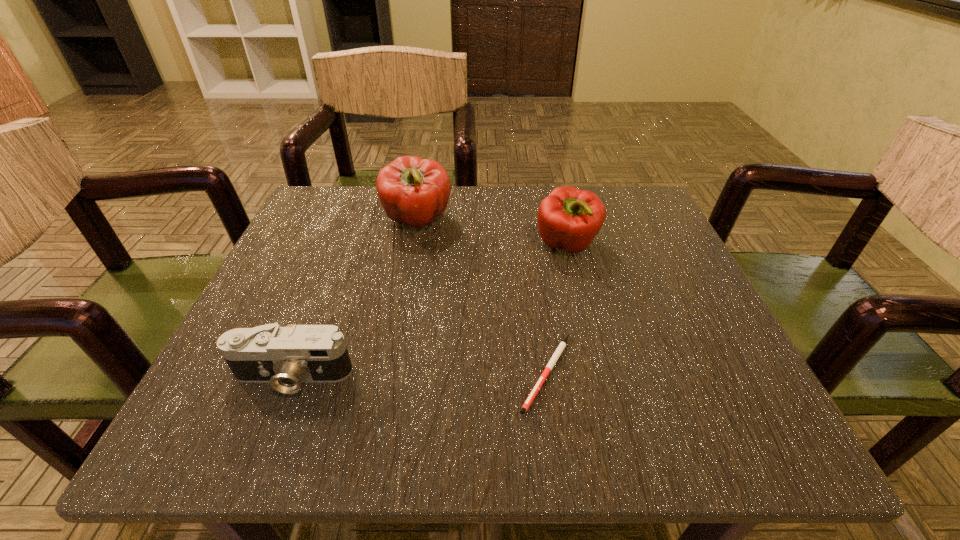
Image resolution: width=960 pixels, height=540 pixels. What are the coordinates of `free point at the far right corner` in the screenshot? It's located at (655, 236).

Locate an element on the screen. The width and height of the screenshot is (960, 540). free space between the shortest object and the camera is located at coordinates point(420,375).

Find the location of a particular element. This screenshot has width=960, height=540. free point between the third shortest object and the left bell pepper is located at coordinates (492, 233).

You are a GUI agent. You are given a task and a screenshot of the screen. Output one action in this format:
    pyautogui.click(x=<x>, y=<y>)
    Task: Click on the free space between the third shortest object and the left bell pepper
    Image resolution: width=960 pixels, height=540 pixels.
    Given the screenshot: What is the action you would take?
    pyautogui.click(x=492, y=233)

Locate an element on the screen. vacant space in between the left bell pepper and the shortest object is located at coordinates (482, 296).

In order to click on free point between the camera and the pen in this screenshot , I will do `click(420, 375)`.

At what (x,y) coordinates should I click in order to perform the action: click on vacant space in between the camera and the left bell pepper. Please return your answer as a coordinate pair (x, y). The width and height of the screenshot is (960, 540). Looking at the image, I should click on (355, 299).

I want to click on free space that is in between the left bell pepper and the camera, so click(x=355, y=299).

You are a GUI agent. You are given a task and a screenshot of the screen. Output one action in this format:
    pyautogui.click(x=<x>, y=<y>)
    Task: Click on the empty space between the third tallest object and the pen
    The image size is (960, 540).
    Given the screenshot: What is the action you would take?
    pyautogui.click(x=420, y=375)

Locate an element on the screen. free space between the shortest object and the third tallest object is located at coordinates (420, 375).